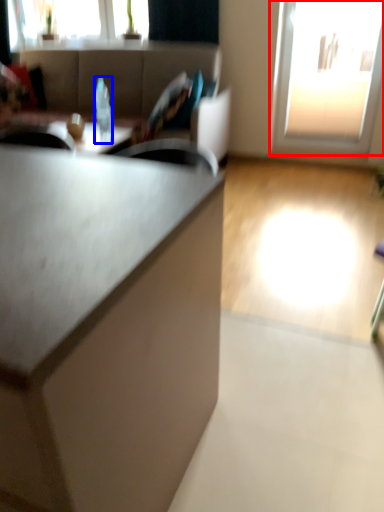
Question: Among these objects, which one is nearest to the camera, window (highlighted by a red box) or bottle (highlighted by a blue box)?

Choices:
 (A) window
 (B) bottle

Answer: (B)